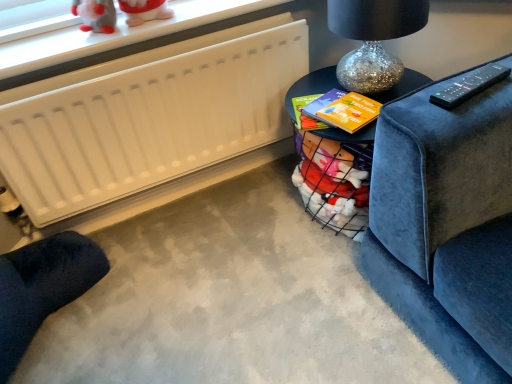
Question: Is matte black table at upper right, which is the second table from front to back, wider than dark blue fabric footrest at lower left?

Choices:
 (A) yes
 (B) no

Answer: (B)

Question: Does matte black table at upper right, which is the second table from front to back, contain dark blue fabric footrest at lower left?

Choices:
 (A) yes
 (B) no

Answer: (B)

Question: Is matte black table at upper right, which is the first table from back to front, facing away from dark blue fabric footrest at lower left?

Choices:
 (A) no
 (B) yes

Answer: (A)

Question: From the image's perspective, is matte black table at upper right, which is the second table from front to back, on top of dark blue fabric footrest at lower left?

Choices:
 (A) no
 (B) yes

Answer: (B)

Question: Does matte black table at upper right, which is the second table from front to back, have a lesser height compared to dark blue fabric footrest at lower left?

Choices:
 (A) no
 (B) yes

Answer: (B)

Question: Is matte black table at upper right, which is the second table from front to back, taller than dark blue fabric footrest at lower left?

Choices:
 (A) yes
 (B) no

Answer: (B)

Question: Does black glossy table at center, the first table in the front-to-back sequence, turn towards dark blue fabric footrest at lower left?

Choices:
 (A) yes
 (B) no

Answer: (A)

Question: Is black glossy table at center, the first table in the front-to-back sequence, completely or partially outside of dark blue fabric footrest at lower left?

Choices:
 (A) yes
 (B) no

Answer: (A)

Question: Are black glossy table at center, arranged as the 2th table when viewed from the back, and dark blue fabric footrest at lower left making contact?

Choices:
 (A) yes
 (B) no

Answer: (B)

Question: Is dark blue fabric footrest at lower left surrounded by black glossy table at center, arranged as the 2th table when viewed from the back?

Choices:
 (A) no
 (B) yes

Answer: (A)

Question: Would you consider black glossy table at center, arranged as the 2th table when viewed from the back, to be distant from dark blue fabric footrest at lower left?

Choices:
 (A) yes
 (B) no

Answer: (B)

Question: Is black glossy table at center, the first table in the front-to-back sequence, positioned behind dark blue fabric footrest at lower left?

Choices:
 (A) yes
 (B) no

Answer: (A)

Question: Is black glossy table at center, the first table in the front-to-back sequence, bigger than white matte radiator at upper left?

Choices:
 (A) yes
 (B) no

Answer: (A)